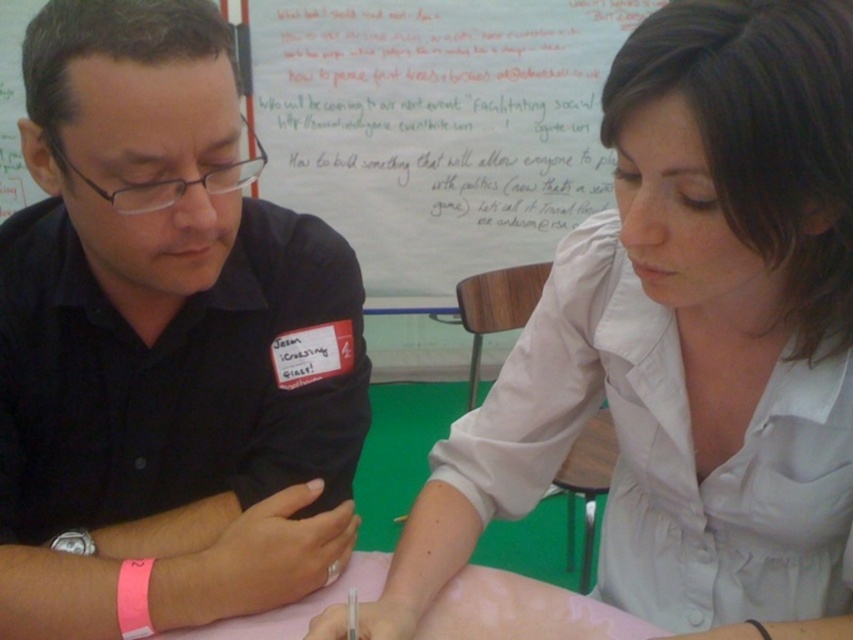
You are a photographer taking a portrait of the two people at the table. You need to ensure that both the light beige shirt at center and the pink paper at center are clearly visible in the photo. Based on their sizes, which object should you focus on first to ensure proper exposure?

The light beige shirt at center has a greater height compared to the pink paper at center, so you should focus on the light beige shirt at center first to ensure proper exposure because it is larger in size.

You are a photographer standing in front of the scene. You want to take a photo of the black shirt at left and the white paperboard at upper center. Which object should you zoom in more on to ensure both are clearly visible in the photo?

The black shirt at left is thinner than the white paperboard at upper center, so you should zoom in more on the white paperboard at upper center to ensure both are clearly visible in the photo.